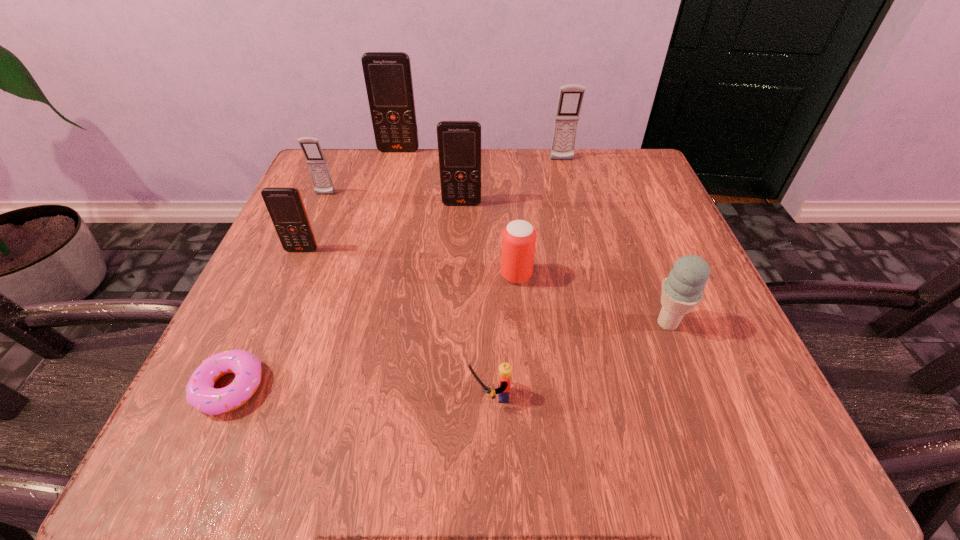
Where is `free spot located 0.350m on the screen of the smallest orange cellular telephone`? This screenshot has width=960, height=540. free spot located 0.350m on the screen of the smallest orange cellular telephone is located at coordinates (221, 437).

You are a GUI agent. You are given a task and a screenshot of the screen. Output one action in this format:
    pyautogui.click(x=<x>, y=<y>)
    Task: Click on the free space located 0.080m on the front-facing side of the smaller gray cellular telephone
    
    Given the screenshot: What is the action you would take?
    pyautogui.click(x=314, y=220)

The image size is (960, 540). I want to click on vacant space located on the left of the seventh farthest object, so click(x=437, y=323).

This screenshot has height=540, width=960. What are the coordinates of `vacant space located 0.300m on the left of the beer can` in the screenshot? It's located at (327, 275).

Where is `free space located 0.200m on the front-facing side of the Lego`? This screenshot has height=540, width=960. free space located 0.200m on the front-facing side of the Lego is located at coordinates [323, 395].

Where is `vacant region located on the front-facing side of the Lego`? vacant region located on the front-facing side of the Lego is located at coordinates (286, 395).

At what (x,y) coordinates should I click in order to perform the action: click on vacant space located on the front-facing side of the Lego. Please return your answer as a coordinate pair (x, y). The width and height of the screenshot is (960, 540). Looking at the image, I should click on (433, 395).

Locate an element on the screen. The width and height of the screenshot is (960, 540). vacant space positioned on the right of the pink doughnut is located at coordinates (396, 387).

The width and height of the screenshot is (960, 540). In order to click on Lego positioned at the near edge in this screenshot , I will do `click(505, 369)`.

Where is `doughnut that is at the near edge`? Image resolution: width=960 pixels, height=540 pixels. doughnut that is at the near edge is located at coordinates (200, 393).